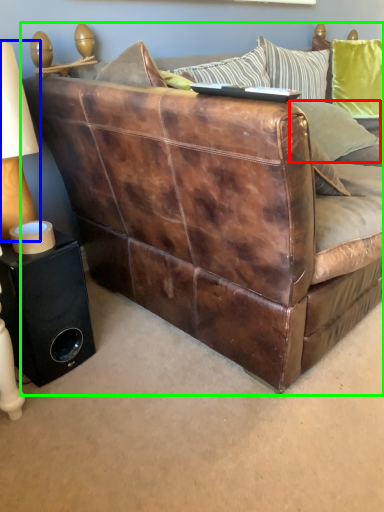
Question: Based on their relative distances, which object is nearer to pillow (highlighted by a red box)? Choose from table lamp (highlighted by a blue box) and studio couch (highlighted by a green box).

Choices:
 (A) table lamp
 (B) studio couch

Answer: (B)